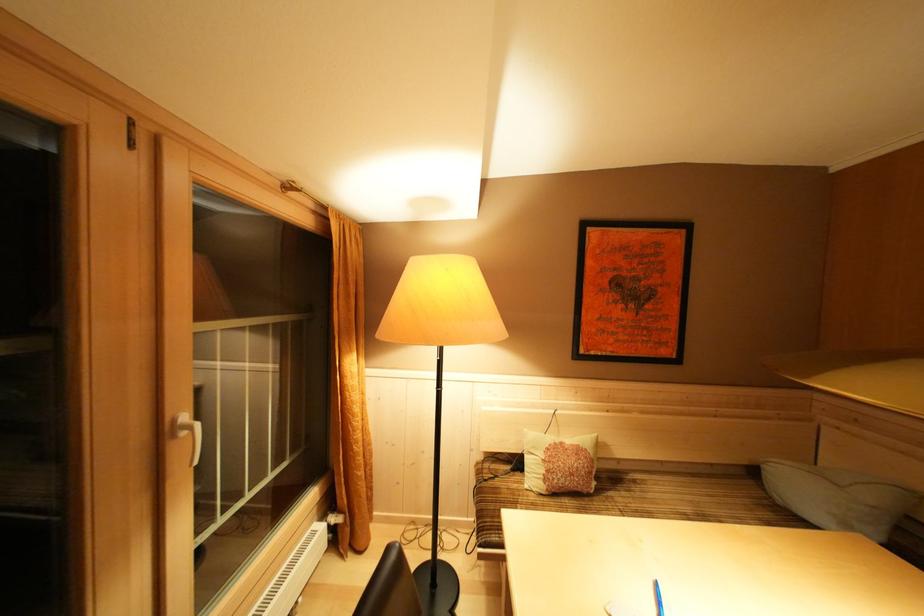
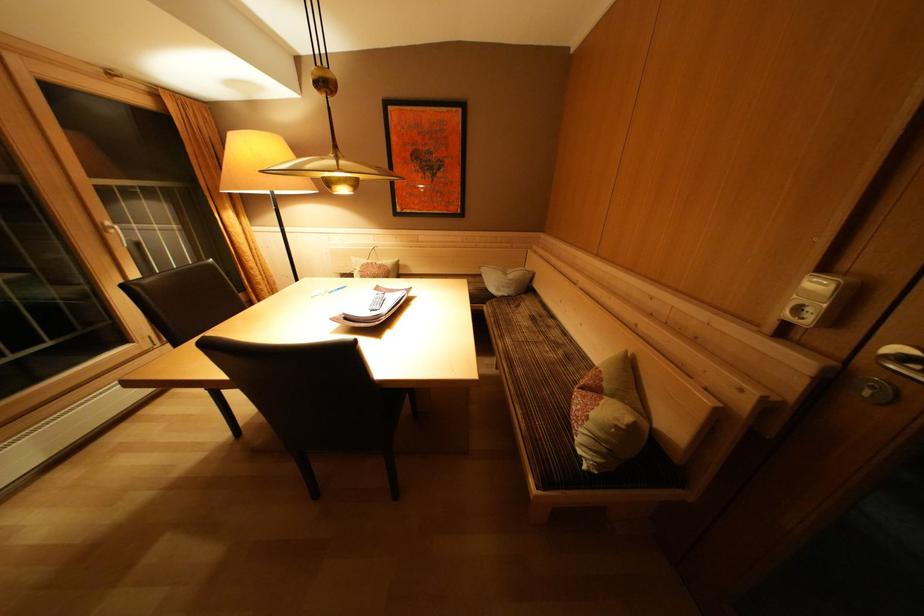
Where in the second image is the point corresponding to (879,503) from the first image?

(517, 281)